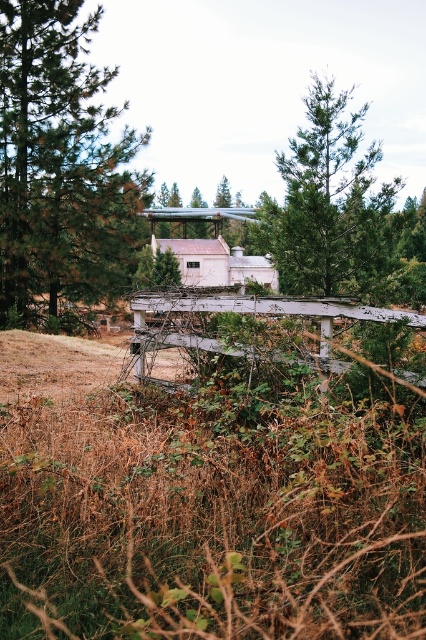
Based on the scene described, if you were standing in front of the white weathered wood fence at center, which direction would you need to look to see the green textured pine tree at upper center?

You would need to look to the right to see the green textured pine tree at upper center since it is positioned to the right of the white weathered wood fence at center.

You are a painter setting up your easel to capture the rural scene. You want to focus on the green textured pine tree at upper center and the white weathered wood fence at center. Which object should you position closer to the edge of your canvas to ensure both are visible without overcrowding?

The white weathered wood fence at center should be positioned closer to the edge of your canvas because the green textured pine tree at upper center is wider, so placing the narrower fence near the edge will prevent overcrowding and allow both elements to fit comfortably within the canvas.